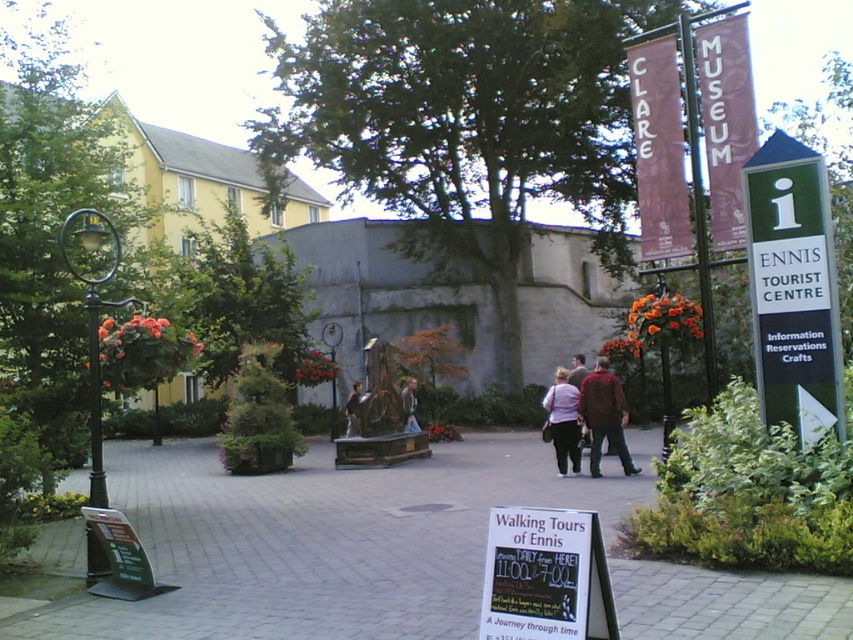
Measure the distance between green plastic sign at right and camera.

green plastic sign at right is 23.57 feet away from camera.

What do you see at coordinates (793, 289) in the screenshot?
I see `green plastic sign at right` at bounding box center [793, 289].

What do you see at coordinates (793, 289) in the screenshot? This screenshot has width=853, height=640. I see `green plastic sign at right` at bounding box center [793, 289].

The image size is (853, 640). I want to click on green plastic sign at right, so click(793, 289).

The height and width of the screenshot is (640, 853). Find the location of `green plastic sign at right`. green plastic sign at right is located at coordinates (793, 289).

Which is more to the left, green plastic sign at right or dark brown leather jacket at center?

dark brown leather jacket at center is more to the left.

Measure the distance between green plastic sign at right and camera.

green plastic sign at right is 7.18 meters from camera.

Find the location of `green plastic sign at right`. green plastic sign at right is located at coordinates click(793, 289).

Is paved stone at center thinner than striped fabric jacket at center?

No.

Identify the location of paved stone at center. The width and height of the screenshot is (853, 640). (393, 552).

Identify the location of paved stone at center. The image size is (853, 640). (393, 552).